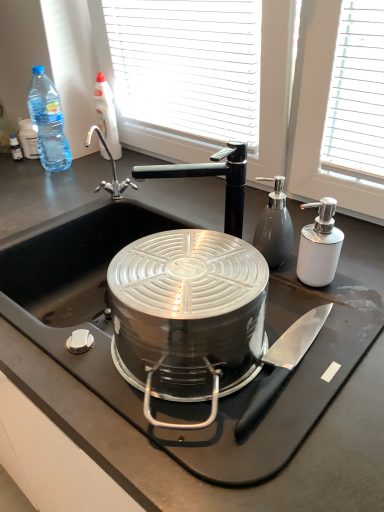
Image resolution: width=384 pixels, height=512 pixels. In order to click on vacant area on the back side of polished stainless steel knife at lower center in this screenshot , I will do `click(299, 298)`.